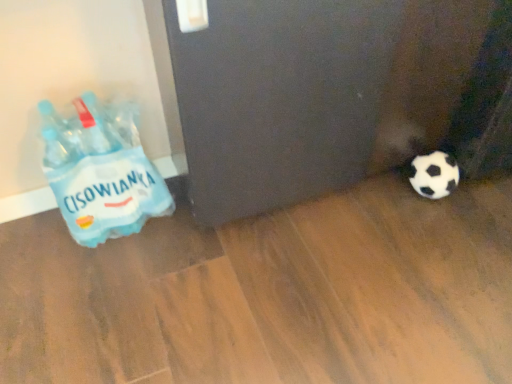
Question: Can you confirm if blue plastic bottle at left is thinner than black matte screen door at lower right?

Choices:
 (A) no
 (B) yes

Answer: (B)

Question: Is blue plastic bottle at left wider than black matte screen door at lower right?

Choices:
 (A) yes
 (B) no

Answer: (B)

Question: From a real-world perspective, is blue plastic bottle at left positioned under black matte screen door at lower right based on gravity?

Choices:
 (A) yes
 (B) no

Answer: (A)

Question: Is the surface of blue plastic bottle at left in direct contact with black matte screen door at lower right?

Choices:
 (A) no
 (B) yes

Answer: (A)

Question: Would you say blue plastic bottle at left is outside black matte screen door at lower right?

Choices:
 (A) yes
 (B) no

Answer: (A)

Question: Is blue plastic bottle at left facing away from black matte screen door at lower right?

Choices:
 (A) yes
 (B) no

Answer: (B)

Question: From a real-world perspective, is black matte screen door at lower right physically below blue plastic bottle at left?

Choices:
 (A) no
 (B) yes

Answer: (A)

Question: Does black matte screen door at lower right appear on the right side of blue plastic bottle at left?

Choices:
 (A) yes
 (B) no

Answer: (A)

Question: Is the position of black matte screen door at lower right less distant than that of blue plastic bottle at left?

Choices:
 (A) yes
 (B) no

Answer: (A)

Question: From a real-world perspective, is black matte screen door at lower right on blue plastic bottle at left?

Choices:
 (A) yes
 (B) no

Answer: (A)

Question: Is blue plastic bottle at left at the back of black matte screen door at lower right?

Choices:
 (A) yes
 (B) no

Answer: (B)

Question: Does black matte screen door at lower right come behind blue plastic bottle at left?

Choices:
 (A) yes
 (B) no

Answer: (B)

Question: Considering the positions of black matte screen door at lower right and blue plastic bottle at left in the image, is black matte screen door at lower right wider or thinner than blue plastic bottle at left?

Choices:
 (A) wide
 (B) thin

Answer: (A)